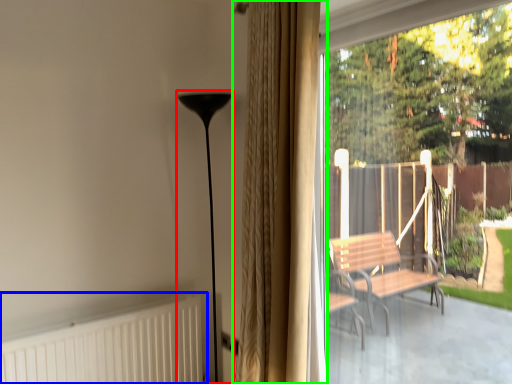
Question: Which object is positioned farthest from lamp (highlighted by a red box)? Select from radiator (highlighted by a blue box) and curtain (highlighted by a green box).

Choices:
 (A) radiator
 (B) curtain

Answer: (B)